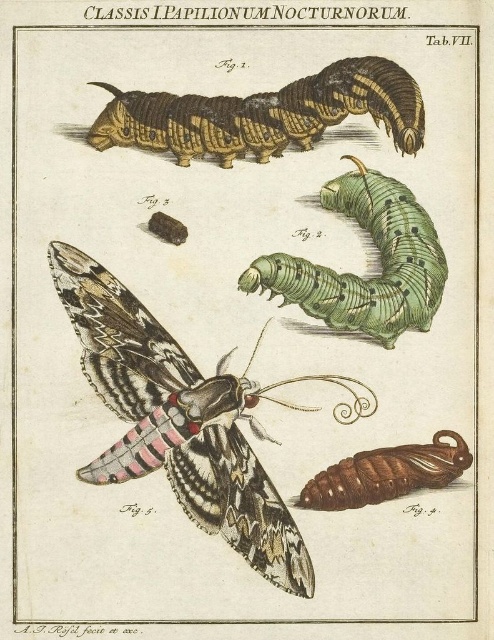
Who is more forward, (173, 100) or (440, 477)?

Point (440, 477) is in front.

Between brown textured caterpillar at upper left and brown glossy caterpillar at lower right, which one appears on the right side from the viewer's perspective?

brown glossy caterpillar at lower right

Who is more distant from viewer, (300, 138) or (352, 499)?

Point (300, 138)

Where is `brown textured caterpillar at upper left`? The height and width of the screenshot is (640, 494). brown textured caterpillar at upper left is located at coordinates (264, 115).

How distant is speckled brown butterfly at center from brown textured caterpillar at upper left?

speckled brown butterfly at center is 14.50 inches away from brown textured caterpillar at upper left.

Can you confirm if speckled brown butterfly at center is bigger than brown textured caterpillar at upper left?

Yes, speckled brown butterfly at center is bigger than brown textured caterpillar at upper left.

Does point (64, 260) come closer to viewer compared to point (221, 106)?

Yes, point (64, 260) is in front of point (221, 106).

Identify the location of speckled brown butterfly at center. (182, 420).

Measure the distance between point (150, 368) and camera.

A distance of 1.45 meters exists between point (150, 368) and camera.

Between point (169, 368) and point (378, 323), which one is positioned behind?

The point (378, 323) is behind.

Which is behind, point (301, 576) or point (354, 282)?

The point (354, 282) is behind.

The image size is (494, 640). I want to click on speckled brown butterfly at center, so click(x=182, y=420).